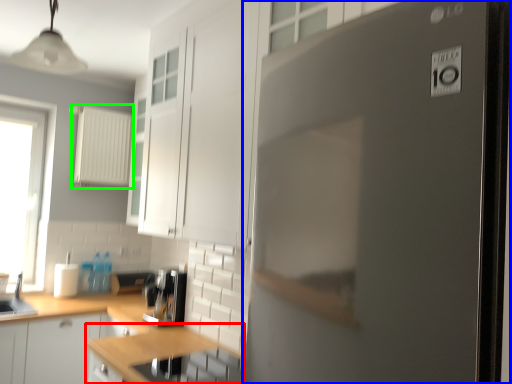
Question: Which object is the closest to the countertop (highlighted by a red box)? Choose among these: refrigerator (highlighted by a blue box) or appliance (highlighted by a green box).

Choices:
 (A) refrigerator
 (B) appliance

Answer: (A)